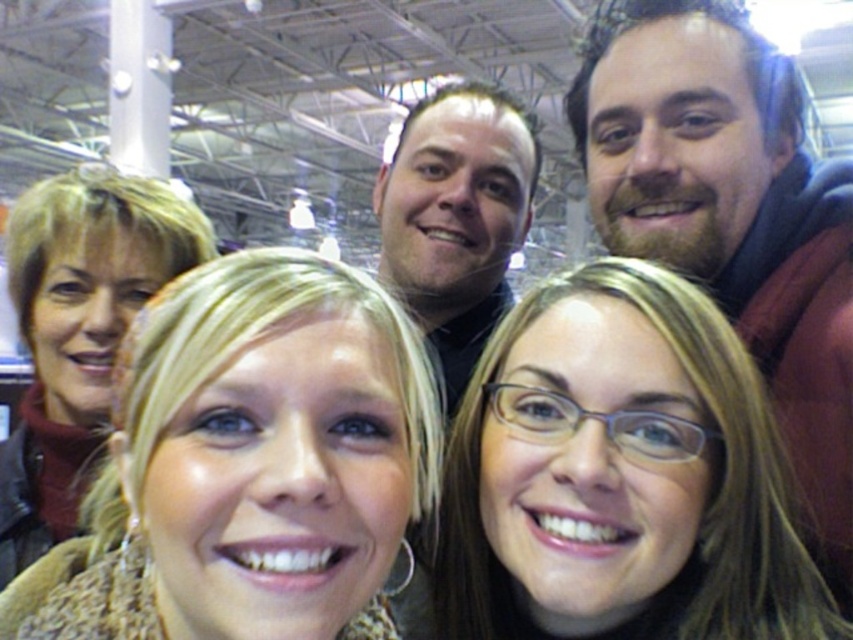
Between bearded man at upper right and blonde hair at upper left, which one appears on the left side from the viewer's perspective?

blonde hair at upper left is more to the left.

Is bearded man at upper right wider than blonde hair at upper left?

No, bearded man at upper right is not wider than blonde hair at upper left.

Which is in front, point (711, 28) or point (410, 356)?

Point (410, 356) is in front.

You are a GUI agent. You are given a task and a screenshot of the screen. Output one action in this format:
    pyautogui.click(x=<x>, y=<y>)
    Task: Click on the bearded man at upper right
    This screenshot has height=640, width=853.
    Given the screenshot: What is the action you would take?
    pyautogui.click(x=732, y=214)

At what (x,y) coordinates should I click in order to perform the action: click on matte brown hair at center. Please return your answer as a coordinate pair (x, y). The image size is (853, 640). Looking at the image, I should click on (621, 476).

Does matte brown hair at center have a greater width compared to bearded man at upper right?

Indeed, matte brown hair at center has a greater width compared to bearded man at upper right.

Is point (494, 627) farther from viewer compared to point (619, 179)?

No, it is in front of (619, 179).

The height and width of the screenshot is (640, 853). I want to click on matte brown hair at center, so click(621, 476).

Does bearded man at upper right lie behind dark brown hair at upper center?

No, it is not.

Is bearded man at upper right in front of dark brown hair at upper center?

That is True.

Does point (717, 296) come in front of point (415, 266)?

That is True.

Locate an element on the screen. The image size is (853, 640). bearded man at upper right is located at coordinates (732, 214).